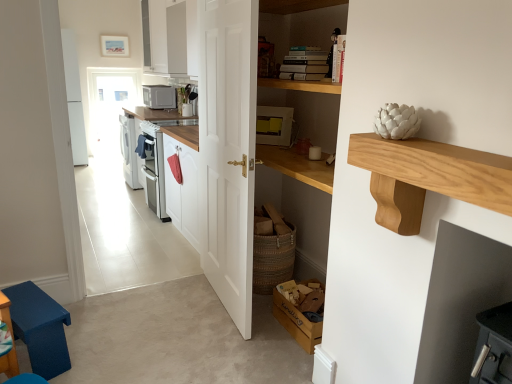
The width and height of the screenshot is (512, 384). In order to click on vacant space positioned to the left of white wooden door at center in this screenshot , I will do `click(163, 306)`.